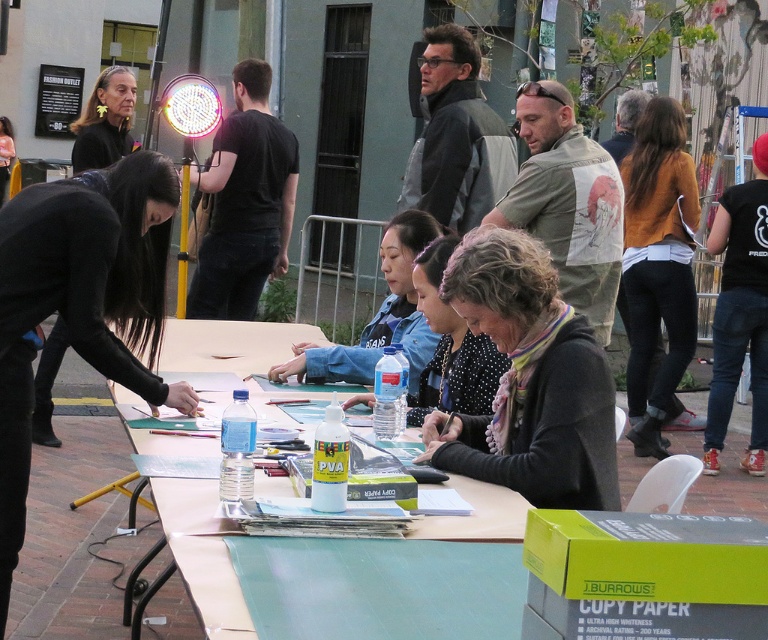
You are standing in front of the table where the art activity is happening. You need to hand out a glue bottle to the person wearing the denim jacket at center and the person wearing the polka dot blouse at center. Which person should you approach first to give them the glue bottle?

You should approach the person wearing the denim jacket at center first because it is closer to you than the polka dot blouse at center, which is further away.

You are organizing a winter clothing drive and need to pack items into boxes. You have a multicolored scarf at center and a brown sweater at right. Which item is located underneath the other?

The multicolored scarf at center is positioned under brown sweater at right.

You are standing at the edge of the brick area and want to place a new craft kit on the light brown wooden table at center. Based on the coordinates provided, can you confirm if the point at (202, 554) is the correct location for the table?

Yes, the point at (202, 554) corresponds to the light brown wooden table at center, so placing the craft kit there would be correct.